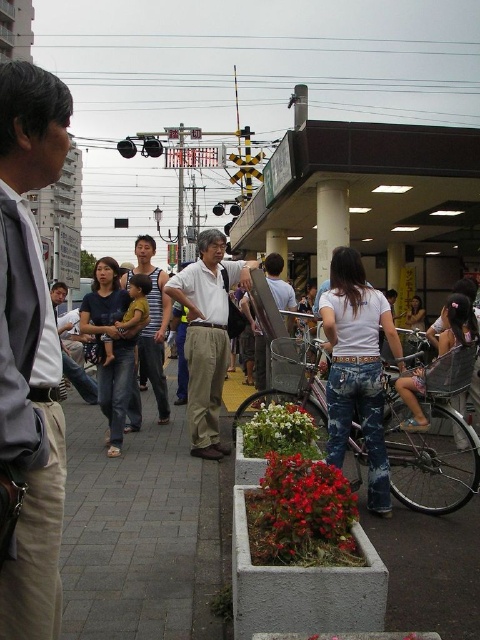
You are a photographer standing on the gray concrete pavement at center and want to take a photo of the matte black tank top at center. Considering their sizes, which object will occupy more space in your photo?

The matte black tank top at center will occupy more space in the photo because it is larger than the gray concrete pavement at center according to the description.

You are a photographer positioned on the train station platform. You notice the gray concrete pavement at center and the matte white shirt at center in your viewfinder. Based on their positions, which object is closer to the camera?

The gray concrete pavement at center is below the matte white shirt at center, indicating it is closer to the camera.